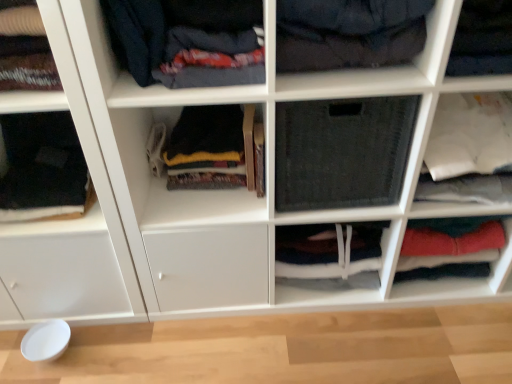
The image size is (512, 384). Describe the element at coordinates (482, 39) in the screenshot. I see `black fabric at upper right, the 4th shelf viewed from the left` at that location.

What is the approximate width of red fabric pants at lower right, positioned as the second cabinet in left-to-right order?

red fabric pants at lower right, positioned as the second cabinet in left-to-right order, is 4.92 inches wide.

Describe the element at coordinates (207, 148) in the screenshot. I see `dark gray fleece sweater at center, the second clothing when ordered from left to right` at that location.

What do you see at coordinates (42, 169) in the screenshot? I see `black fabric at left, the fourth clothing positioned from the right` at bounding box center [42, 169].

At what (x,y) coordinates should I click in order to perform the action: click on white glossy cabinet at left, which is counted as the 1th shelf, starting from the left. Please return your answer as a coordinate pair (x, y). This screenshot has width=512, height=384. Looking at the image, I should click on (68, 224).

How much distance is there between dark blue fabric at upper left, acting as the 3th clothing starting from the left, and white glossy cabinet at left, which is counted as the 1th shelf, starting from the left?

They are 15.06 inches apart.

Is dark blue fabric at upper left, arranged as the second clothing when viewed from the right, facing towards white glossy cabinet at left, which is counted as the 1th shelf, starting from the left?

No, dark blue fabric at upper left, arranged as the second clothing when viewed from the right, is not oriented towards white glossy cabinet at left, which is counted as the 1th shelf, starting from the left.

Is dark blue fabric at upper left, arranged as the second clothing when viewed from the right, at the right side of white glossy cabinet at left, the fifth shelf viewed from the right?

Indeed, dark blue fabric at upper left, arranged as the second clothing when viewed from the right, is positioned on the right side of white glossy cabinet at left, the fifth shelf viewed from the right.

From the image's perspective, which is below, dark blue fabric at upper left, acting as the 3th clothing starting from the left, or white glossy cabinet at left, which is counted as the 1th shelf, starting from the left?

From the image's view, white glossy cabinet at left, which is counted as the 1th shelf, starting from the left, is below.

From the image's perspective, which one is positioned lower, dark gray fleece sweater at center, the second clothing when ordered from left to right, or dark blue fabric at upper left, acting as the 3th clothing starting from the left?

dark gray fleece sweater at center, the second clothing when ordered from left to right, is shown below in the image.

Between dark gray fleece sweater at center, which ranks as the 3th clothing in right-to-left order, and dark blue fabric at upper left, arranged as the second clothing when viewed from the right, which one appears on the right side from the viewer's perspective?

dark blue fabric at upper left, arranged as the second clothing when viewed from the right, is more to the right.

Does dark gray fleece sweater at center, which ranks as the 3th clothing in right-to-left order, have a larger size compared to dark blue fabric at upper left, acting as the 3th clothing starting from the left?

No.

Is the position of dark gray fleece sweater at center, the second clothing when ordered from left to right, more distant than that of dark blue fabric at upper left, arranged as the second clothing when viewed from the right?

Yes.

Considering the sizes of objects dark gray fabric at center, the second cabinet viewed from the right, and black fabric at center, arranged as the first shelf when viewed from the right, in the image provided, who is wider, dark gray fabric at center, the second cabinet viewed from the right, or black fabric at center, arranged as the first shelf when viewed from the right,?

black fabric at center, arranged as the first shelf when viewed from the right.

Would you say dark gray fabric at center, the second cabinet viewed from the right, is to the left or to the right of black fabric at center, arranged as the first shelf when viewed from the right, in the picture?

From the image, it's evident that dark gray fabric at center, the second cabinet viewed from the right, is to the left of black fabric at center, arranged as the first shelf when viewed from the right.

Is dark gray fabric at center, the second cabinet viewed from the right, outside of black fabric at center, the fifth shelf viewed from the left?

That's correct, dark gray fabric at center, the second cabinet viewed from the right, is outside of black fabric at center, the fifth shelf viewed from the left.

Is dark gray fabric at center, which ranks as the first cabinet in left-to-right order, in front of or behind black fabric at center, arranged as the first shelf when viewed from the right, in the image?

dark gray fabric at center, which ranks as the first cabinet in left-to-right order, is positioned farther from the viewer than black fabric at center, arranged as the first shelf when viewed from the right.

From a real-world perspective, which is physically below, dark gray fabric at center, the second cabinet viewed from the right, or white glossy cabinet at left, which is counted as the 1th shelf, starting from the left?

dark gray fabric at center, the second cabinet viewed from the right, is physically lower.

Is dark gray fabric at center, the second cabinet viewed from the right, in contact with white glossy cabinet at left, which is counted as the 1th shelf, starting from the left?

No, dark gray fabric at center, the second cabinet viewed from the right, is not with white glossy cabinet at left, which is counted as the 1th shelf, starting from the left.

Which of these two, dark gray fabric at center, the second cabinet viewed from the right, or white glossy cabinet at left, which is counted as the 1th shelf, starting from the left, is thinner?

dark gray fabric at center, the second cabinet viewed from the right, is thinner.

Image resolution: width=512 pixels, height=384 pixels. What are the coordinates of `the 1st clothing below the dark blue fabric at upper left, arranged as the second clothing when viewed from the right (from the image's perspective)` in the screenshot? It's located at (342, 152).

Does black fabric at center, placed as the 4th clothing when sorted from left to right, lie behind dark blue fabric at upper left, arranged as the second clothing when viewed from the right?

That is True.

Can you see black fabric at center, placed as the 4th clothing when sorted from left to right, touching dark blue fabric at upper left, acting as the 3th clothing starting from the left?

No, black fabric at center, placed as the 4th clothing when sorted from left to right, is not touching dark blue fabric at upper left, acting as the 3th clothing starting from the left.

Which shelf is the 1st one when counting from the right side of the white glossy cabinet at left, which is counted as the 1th shelf, starting from the left? Please provide its 2D coordinates.

[(57, 67)]

Is white glossy cabinet at left, which is counted as the 1th shelf, starting from the left, completely or partially outside of white matte fabric at upper left, the 2th shelf from the left?

white glossy cabinet at left, which is counted as the 1th shelf, starting from the left, is positioned outside white matte fabric at upper left, the 2th shelf from the left.

Based on the photo, considering the relative positions of white glossy cabinet at left, which is counted as the 1th shelf, starting from the left, and white matte fabric at upper left, which is counted as the 4th shelf, starting from the right, in the image provided, is white glossy cabinet at left, which is counted as the 1th shelf, starting from the left, to the right of white matte fabric at upper left, which is counted as the 4th shelf, starting from the right, from the viewer's perspective?

Incorrect, white glossy cabinet at left, which is counted as the 1th shelf, starting from the left, is not on the right side of white matte fabric at upper left, which is counted as the 4th shelf, starting from the right.

Considering the relative sizes of white glossy cabinet at left, the fifth shelf viewed from the right, and white matte fabric at upper left, the 2th shelf from the left, in the image provided, is white glossy cabinet at left, the fifth shelf viewed from the right, bigger than white matte fabric at upper left, the 2th shelf from the left,?

Correct, white glossy cabinet at left, the fifth shelf viewed from the right, is larger in size than white matte fabric at upper left, the 2th shelf from the left.

Considering the positions of objects black fabric at upper right, the 4th shelf viewed from the left, and black fabric at left, the fourth clothing positioned from the right, in the image provided, who is more to the right, black fabric at upper right, the 4th shelf viewed from the left, or black fabric at left, the fourth clothing positioned from the right,?

From the viewer's perspective, black fabric at upper right, the 4th shelf viewed from the left, appears more on the right side.

In the image, is black fabric at upper right, the 4th shelf viewed from the left, positioned in front of or behind black fabric at left, marked as the first clothing in a left-to-right arrangement?

Visually, black fabric at upper right, the 4th shelf viewed from the left, is located in front of black fabric at left, marked as the first clothing in a left-to-right arrangement.

There is a black fabric at upper right, the 4th shelf viewed from the left. At what (x,y) coordinates should I click in order to perform the action: click on the 2nd clothing below it (from a real-world perspective). Please return your answer as a coordinate pair (x, y). Image resolution: width=512 pixels, height=384 pixels. Looking at the image, I should click on (42, 169).

From the picture: Are black fabric at upper right, the 2th shelf viewed from the right, and black fabric at left, marked as the first clothing in a left-to-right arrangement, located far from each other?

black fabric at upper right, the 2th shelf viewed from the right, is positioned a significant distance from black fabric at left, marked as the first clothing in a left-to-right arrangement.

From a real-world perspective, starting from the white glossy cabinet at left, the fifth shelf viewed from the right, which clothing is the 4th one vertically above it? Please provide its 2D coordinates.

[(181, 40)]

Where is `the 3rd clothing behind when counting from the dark blue fabric at upper left, arranged as the second clothing when viewed from the right`? the 3rd clothing behind when counting from the dark blue fabric at upper left, arranged as the second clothing when viewed from the right is located at coordinates (207, 148).

Based on the photo, estimate the real-world distances between objects in this image. Which object is further from dark gray fabric at center, the second cabinet viewed from the right, red fabric pants at lower right, the 1th cabinet in the right-to-left sequence, or dark blue fabric at upper left, acting as the 3th clothing starting from the left?

dark blue fabric at upper left, acting as the 3th clothing starting from the left.

Considering their positions, is red fabric pants at lower right, the 1th cabinet in the right-to-left sequence, positioned further to dark gray fleece sweater at center, which ranks as the 3th clothing in right-to-left order, than black fabric at center, placed as the 4th clothing when sorted from left to right?

The object further to dark gray fleece sweater at center, which ranks as the 3th clothing in right-to-left order, is red fabric pants at lower right, the 1th cabinet in the right-to-left sequence.

From the image, which object appears to be farther from black fabric at center, the fifth shelf viewed from the left, dark blue fabric at upper left, acting as the 3th clothing starting from the left, or black fabric at left, the fourth clothing positioned from the right?

The object further to black fabric at center, the fifth shelf viewed from the left, is black fabric at left, the fourth clothing positioned from the right.

Which object lies further to the anchor point dark blue fabric at upper center, placed as the third shelf when sorted from right to left, white glossy cabinet at left, the fifth shelf viewed from the right, or black fabric at center, placed as the 4th clothing when sorted from left to right?

white glossy cabinet at left, the fifth shelf viewed from the right, is positioned further to the anchor dark blue fabric at upper center, placed as the third shelf when sorted from right to left.

Based on their spatial positions, is black fabric at center, arranged as the first shelf when viewed from the right, or dark blue fabric at upper center, placed as the third shelf when sorted from right to left, further from white matte fabric at upper left, which is counted as the 4th shelf, starting from the right?

Based on the image, black fabric at center, arranged as the first shelf when viewed from the right, appears to be further to white matte fabric at upper left, which is counted as the 4th shelf, starting from the right.

From the image, which object appears to be farther from black fabric at center, placed as the 4th clothing when sorted from left to right, red fabric pants at lower right, the 1th cabinet in the right-to-left sequence, or dark gray fabric at center, which ranks as the first cabinet in left-to-right order?

red fabric pants at lower right, the 1th cabinet in the right-to-left sequence, is further to black fabric at center, placed as the 4th clothing when sorted from left to right.

In the scene shown: Estimate the real-world distances between objects in this image. Which object is further from red fabric pants at lower right, the 1th cabinet in the right-to-left sequence, dark blue fabric at upper left, arranged as the second clothing when viewed from the right, or dark blue fabric at upper center, which is the third shelf in left-to-right order?

Based on the image, dark blue fabric at upper left, arranged as the second clothing when viewed from the right, appears to be further to red fabric pants at lower right, the 1th cabinet in the right-to-left sequence.

Based on their spatial positions, is dark blue fabric at upper left, arranged as the second clothing when viewed from the right, or dark gray fabric at center, which ranks as the first cabinet in left-to-right order, closer to white matte fabric at upper left, the 2th shelf from the left?

dark blue fabric at upper left, arranged as the second clothing when viewed from the right, lies closer to white matte fabric at upper left, the 2th shelf from the left, than the other object.

You are a GUI agent. You are given a task and a screenshot of the screen. Output one action in this format:
    pyautogui.click(x=<x>, y=<y>)
    Task: Click on the shelf located between white glossy cabinet at left, the fifth shelf viewed from the right, and dark gray fleece sweater at center, which ranks as the 3th clothing in right-to-left order, in the left-right direction
    
    Given the screenshot: What is the action you would take?
    pyautogui.click(x=57, y=67)

This screenshot has width=512, height=384. I want to click on cabinet located between white glossy cabinet at left, which is counted as the 1th shelf, starting from the left, and red fabric pants at lower right, the 1th cabinet in the right-to-left sequence, in the left-right direction, so click(326, 251).

Where is `cabinet between white glossy cabinet at left, the fifth shelf viewed from the right, and black fabric at upper right, the 4th shelf viewed from the left, in the horizontal direction`? cabinet between white glossy cabinet at left, the fifth shelf viewed from the right, and black fabric at upper right, the 4th shelf viewed from the left, in the horizontal direction is located at coordinates (326, 251).

What are the coordinates of `shelf between white matte fabric at upper left, which is counted as the 4th shelf, starting from the right, and dark gray fabric at center, the second cabinet viewed from the right, in the horizontal direction` in the screenshot? It's located at (439, 40).